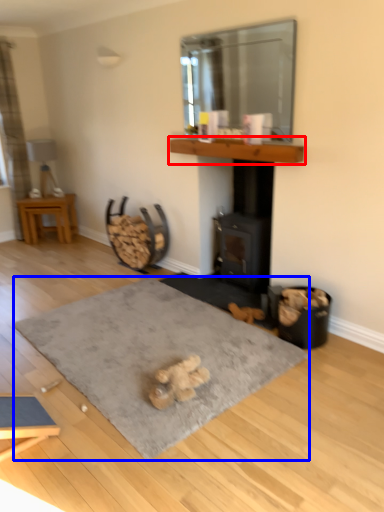
Question: Which point is further to the camera, mantle (highlighted by a red box) or yoga mat (highlighted by a blue box)?

Choices:
 (A) mantle
 (B) yoga mat

Answer: (A)